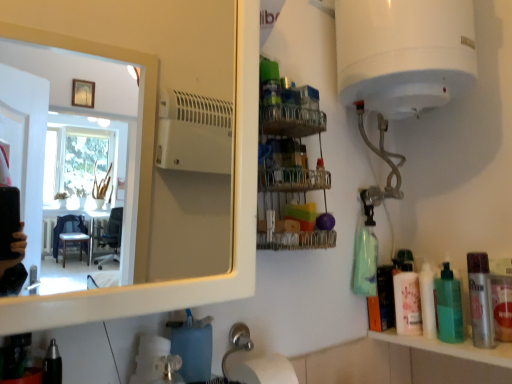
Question: Is white glossy mirror at upper left at the right side of black plastic pen at lower left, the 1th toiletry from the left?

Choices:
 (A) yes
 (B) no

Answer: (A)

Question: Would you consider white glossy mirror at upper left to be distant from black plastic pen at lower left, the 2th toiletry from the right?

Choices:
 (A) yes
 (B) no

Answer: (A)

Question: Can you confirm if white glossy mirror at upper left is thinner than black plastic pen at lower left, arranged as the first toiletry when viewed from the front?

Choices:
 (A) no
 (B) yes

Answer: (A)

Question: From the image's perspective, is white glossy mirror at upper left below black plastic pen at lower left, arranged as the first toiletry when viewed from the front?

Choices:
 (A) yes
 (B) no

Answer: (B)

Question: Does white glossy mirror at upper left appear on the left side of black plastic pen at lower left, the 2th toiletry from the right?

Choices:
 (A) no
 (B) yes

Answer: (A)

Question: Is white glossy mirror at upper left closer to camera compared to black plastic pen at lower left, the 2th toiletry from the right?

Choices:
 (A) no
 (B) yes

Answer: (B)

Question: Can you confirm if white glossy mirror at upper left is smaller than silver metallic mouthwash at right, which appears as the 1th mouthwash when viewed from the front?

Choices:
 (A) yes
 (B) no

Answer: (B)

Question: From the image's perspective, is white glossy mirror at upper left located above silver metallic mouthwash at right, which appears as the 1th mouthwash when viewed from the front?

Choices:
 (A) yes
 (B) no

Answer: (A)

Question: Does white glossy mirror at upper left lie behind silver metallic mouthwash at right, the 2th mouthwash positioned from the back?

Choices:
 (A) no
 (B) yes

Answer: (A)

Question: Does white glossy mirror at upper left lie in front of silver metallic mouthwash at right, which appears as the 1th mouthwash when viewed from the front?

Choices:
 (A) no
 (B) yes

Answer: (B)

Question: Is white glossy mirror at upper left directly adjacent to silver metallic mouthwash at right, the 2th mouthwash positioned from the back?

Choices:
 (A) no
 (B) yes

Answer: (A)

Question: Is white glossy mirror at upper left aimed at silver metallic mouthwash at right, which appears as the 1th mouthwash when viewed from the front?

Choices:
 (A) yes
 (B) no

Answer: (B)

Question: Is green translucent bottle at right, which appears as the 2th mouthwash when viewed from the front, oriented away from silver metallic mouthwash at right, the 2th mouthwash positioned from the back?

Choices:
 (A) yes
 (B) no

Answer: (B)